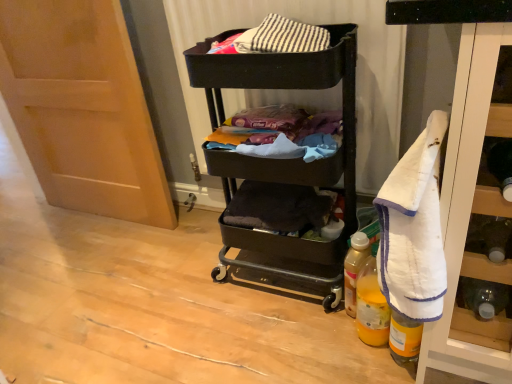
Identify the location of vacant area that is in front of translucent yellow plastic bottle at lower right, the second bottle when ordered from back to front. (373, 370).